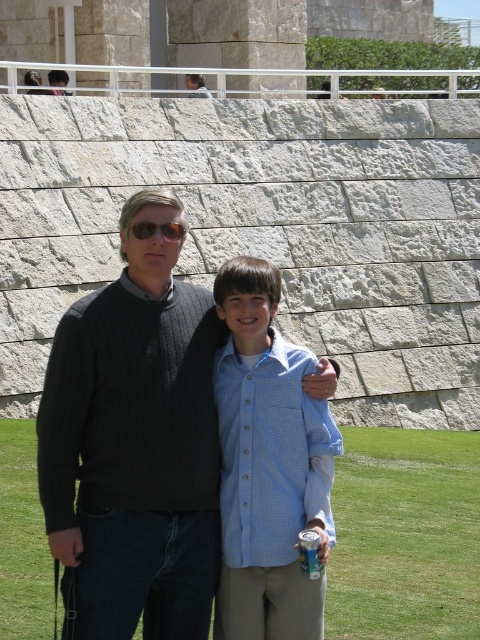
You are standing in front of the stone wall and want to place a small plant between the two points marked as point (314, 541) and point (164, 234). Which point should you start placing the plant closer to so that it is nearer to the viewer?

You should start placing the plant closer to point (314, 541) because it is closer to the viewer than point (164, 234).

You are taking a photo of the scene described. You want to focus on the point closer to the camera between the two points labeled as point [232,310] and point [143,232]. Which point should you focus on?

You should focus on point [143,232] because it is closer to the camera than point [232,310].